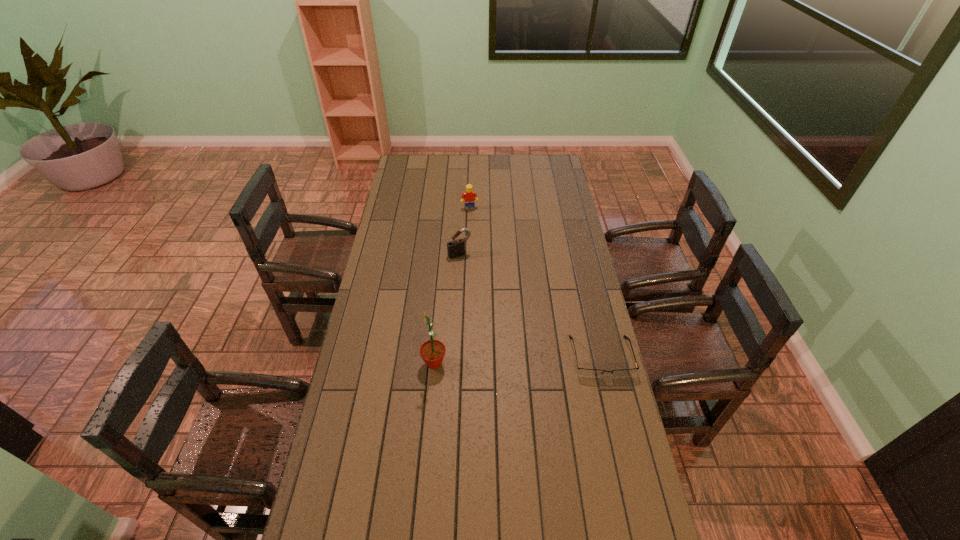
Where is `free spot that satisfies the following two spatial constraints: 1. on the back side of the padlock; 2. on the right side of the farthest object`? The height and width of the screenshot is (540, 960). free spot that satisfies the following two spatial constraints: 1. on the back side of the padlock; 2. on the right side of the farthest object is located at coordinates (462, 208).